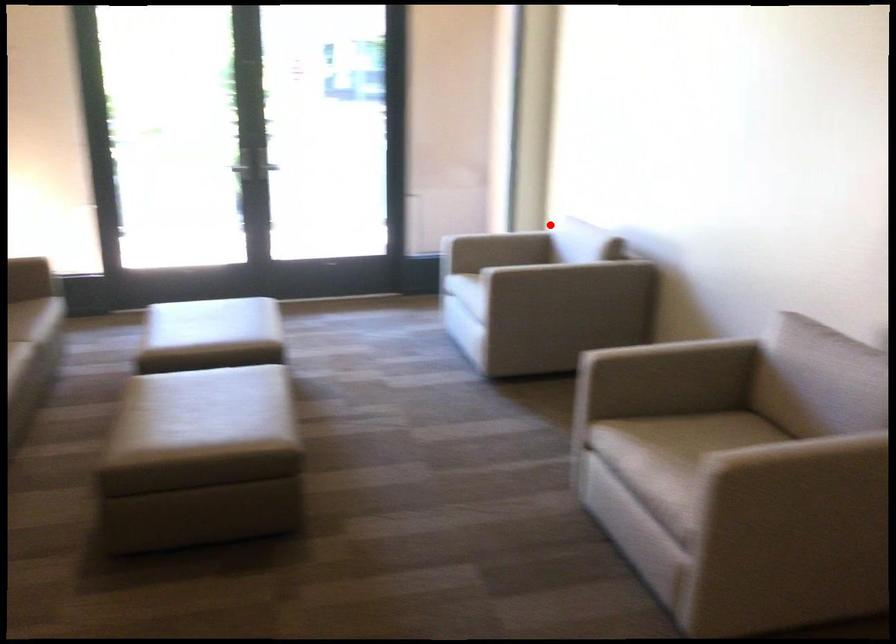
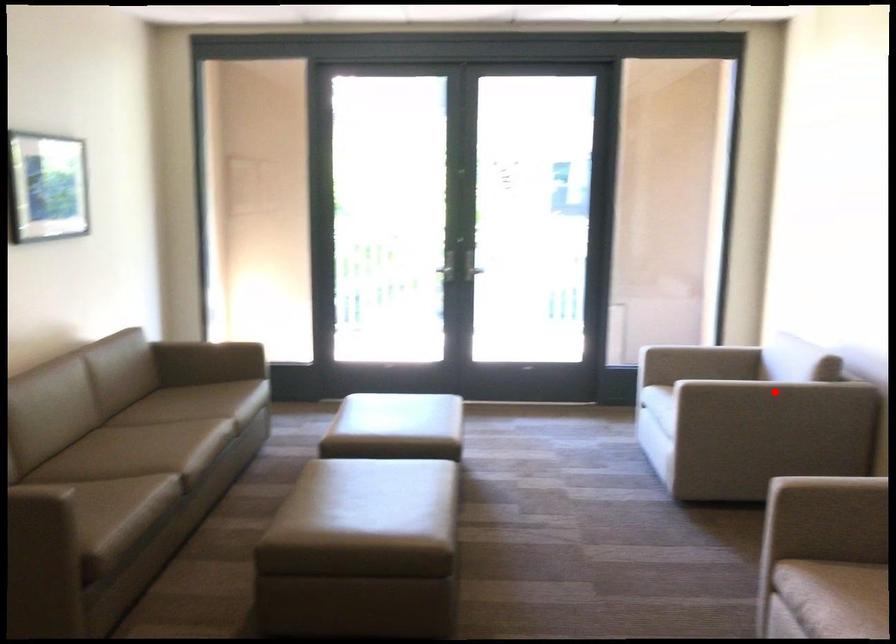
I am providing you with two images of the same scene from different viewpoints. A red point is marked on the first image and another point is marked on the second image. Does the point marked in image1 correspond to the same location as the one in image2?

No